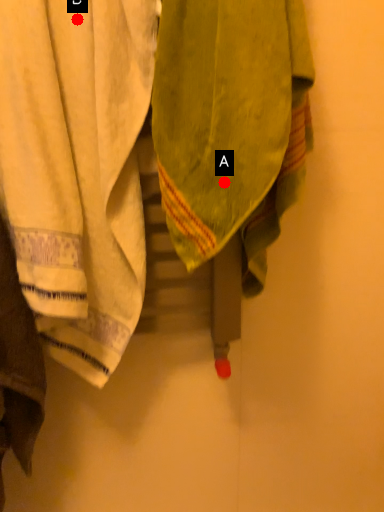
Question: Two points are circled on the image, labeled by A and B beside each circle. Among these points, which one is farthest from the camera?

Choices:
 (A) A is further
 (B) B is further

Answer: (B)